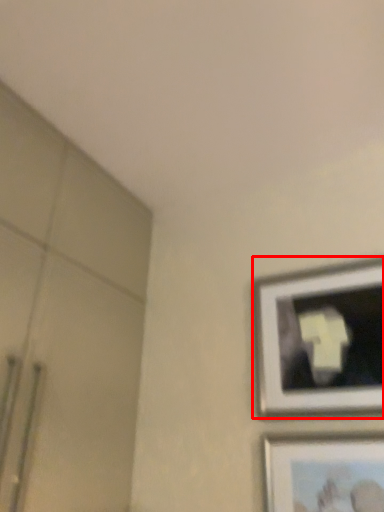
Question: From the image's perspective, what is the correct spatial positioning of picture frame (annotated by the red box) in reference to picture frame?

Choices:
 (A) below
 (B) above

Answer: (B)